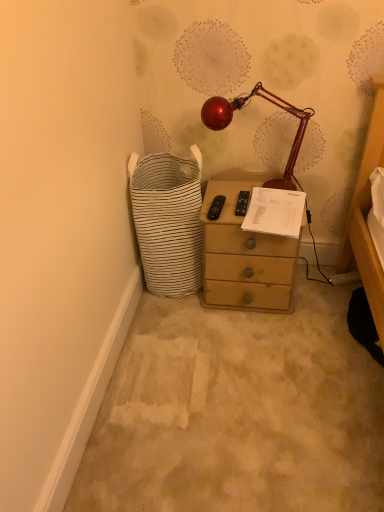
Question: Would you say wooden drawer at center is to the left or to the right of matte brown chest of drawers at center in the picture?

Choices:
 (A) right
 (B) left

Answer: (A)

Question: Is wooden drawer at center wider or thinner than matte brown chest of drawers at center?

Choices:
 (A) thin
 (B) wide

Answer: (B)

Question: Which object is the closest to the glossy red lamp at upper center?

Choices:
 (A) wooden drawer at center
 (B) white striped fabric basket at lower left
 (C) matte brown chest of drawers at center

Answer: (C)

Question: Which object is the closest to the white striped fabric basket at lower left?

Choices:
 (A) matte brown chest of drawers at center
 (B) glossy red lamp at upper center
 (C) wooden drawer at center

Answer: (A)